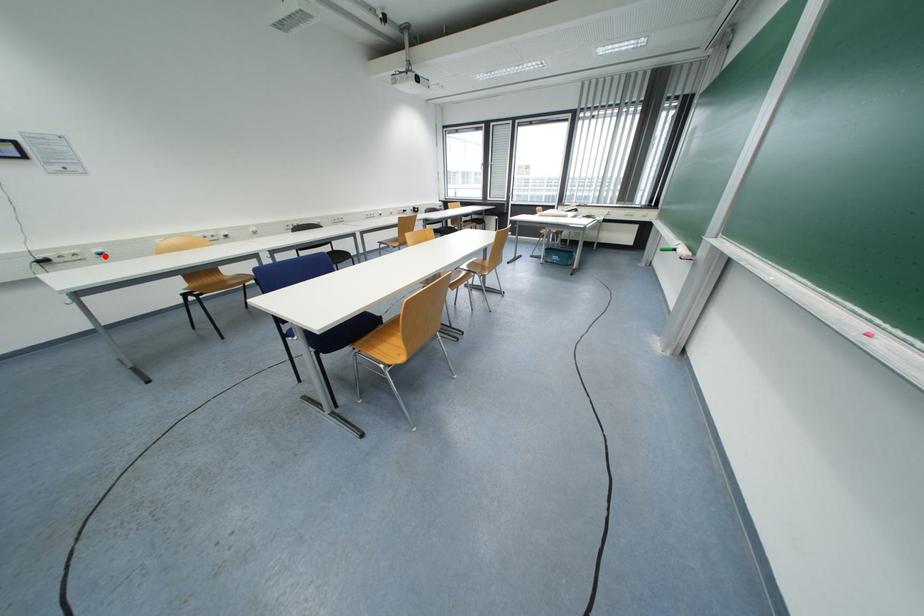
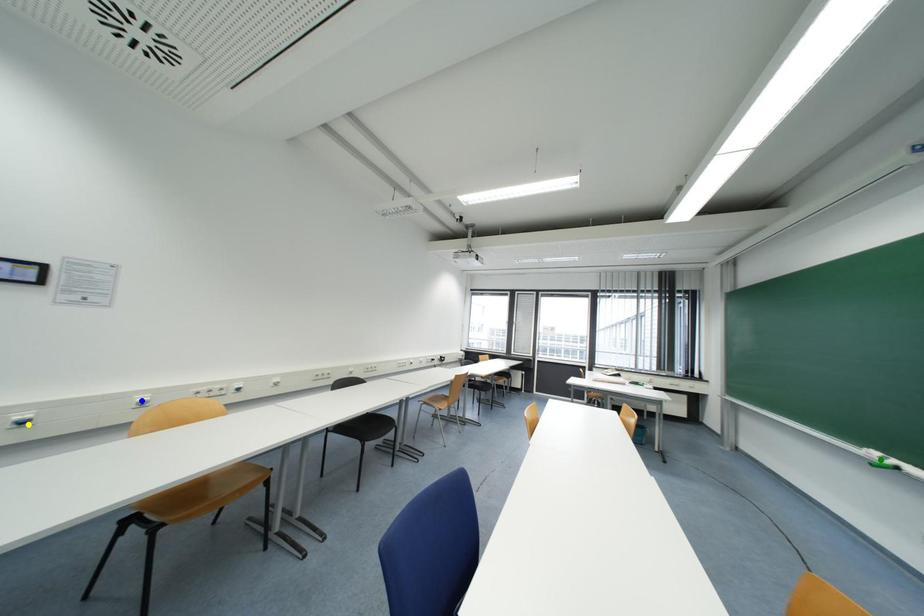
Question: I am providing you with two images of the same scene from different viewpoints. A red point is marked on the first image. You are given multiple points on the second image. Which point in image 2 is actually the same real-world point as the red point in image 1?

Choices:
 (A) yellow point
 (B) green point
 (C) blue point

Answer: (A)